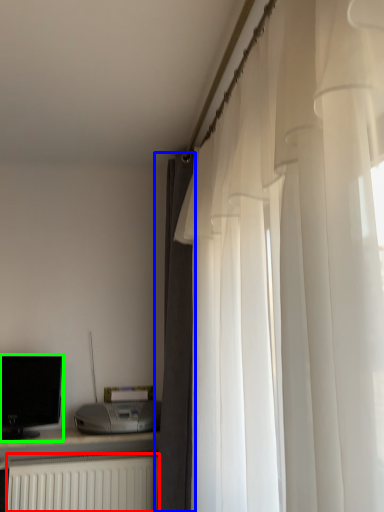
Question: Based on their relative distances, which object is farther from radiator (highlighted by a red box)? Choose from curtain (highlighted by a blue box) and computer monitor (highlighted by a green box).

Choices:
 (A) curtain
 (B) computer monitor

Answer: (A)